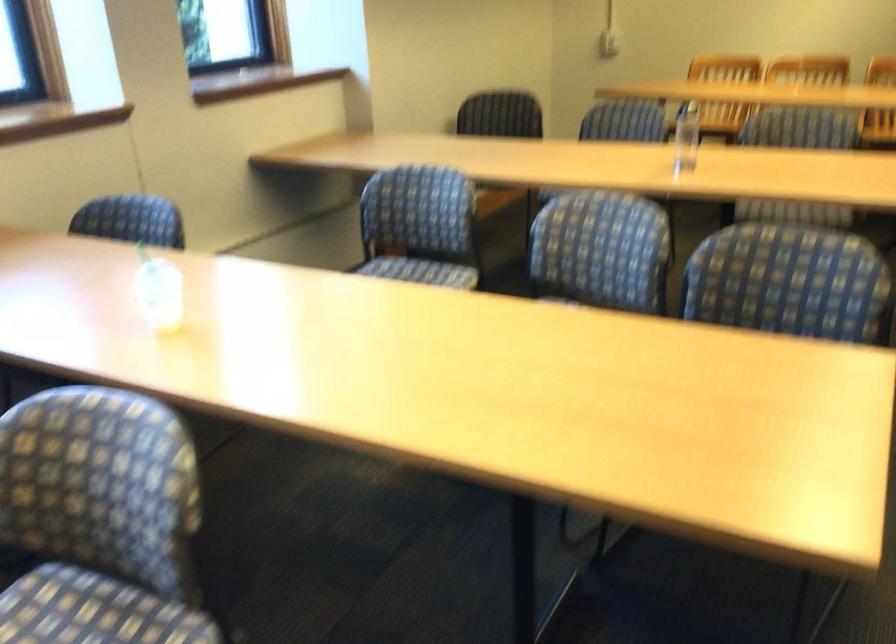
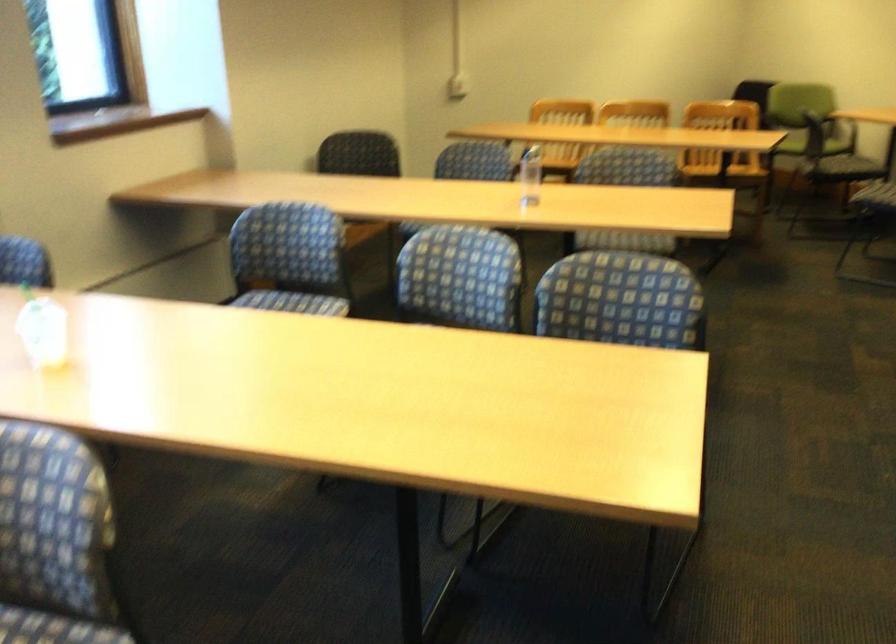
Question: The camera is either moving clockwise (left) or counter-clockwise (right) around the object. The first image is from the beginning of the video and the second image is from the end. Is the camera moving left or right when shooting the video?

Choices:
 (A) Left
 (B) Right

Answer: (A)